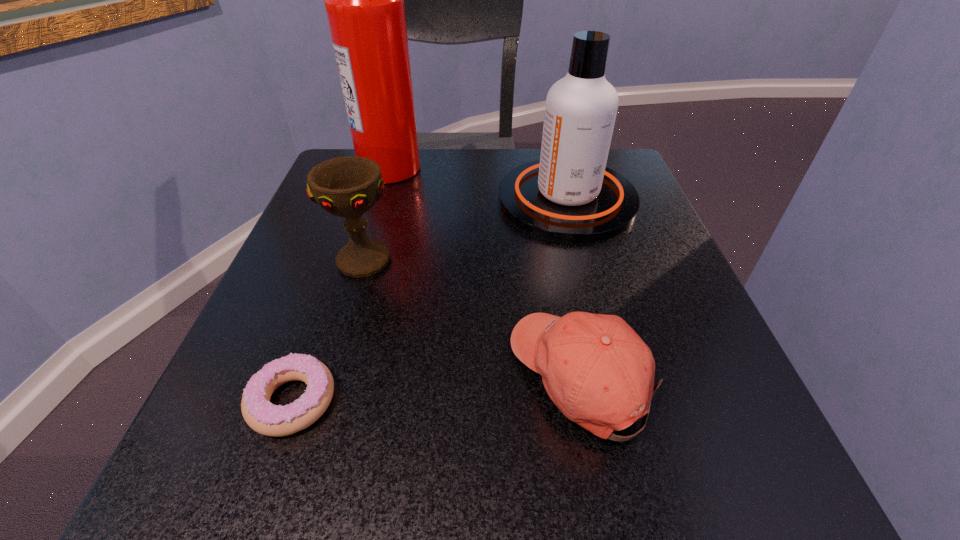
The image size is (960, 540). In order to click on fire extinguisher positioned at the far edge in this screenshot , I will do 364,0.

The height and width of the screenshot is (540, 960). I want to click on cleansing agent positioned at the far edge, so click(x=569, y=195).

You are a GUI agent. You are given a task and a screenshot of the screen. Output one action in this format:
    pyautogui.click(x=<x>, y=<y>)
    Task: Click on the baseball cap at the near edge
    The height and width of the screenshot is (540, 960).
    Given the screenshot: What is the action you would take?
    pyautogui.click(x=596, y=369)

Image resolution: width=960 pixels, height=540 pixels. I want to click on doughnut that is at the near edge, so click(260, 414).

Where is `fire extinguisher located at the left edge`? The image size is (960, 540). fire extinguisher located at the left edge is located at coordinates (364, 0).

Identify the location of chalice at the left edge. This screenshot has width=960, height=540. (349, 186).

At what (x,y) coordinates should I click in order to perform the action: click on doughnut that is at the left edge. Please return your answer as a coordinate pair (x, y). This screenshot has width=960, height=540. Looking at the image, I should click on (260, 414).

Where is `cleansing agent positioned at the right edge`? cleansing agent positioned at the right edge is located at coordinates (569, 195).

Identify the location of baseball cap present at the right edge. The height and width of the screenshot is (540, 960). (596, 369).

Find the location of `object located at the far left corner`. object located at the far left corner is located at coordinates (364, 0).